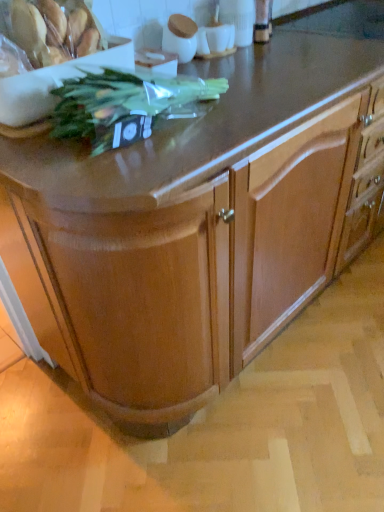
Question: Is green leafy plant at upper left not near translucent plastic bag of cookies at upper left?

Choices:
 (A) yes
 (B) no

Answer: (B)

Question: Considering the relative sizes of green leafy plant at upper left and translucent plastic bag of cookies at upper left in the image provided, is green leafy plant at upper left bigger than translucent plastic bag of cookies at upper left?

Choices:
 (A) no
 (B) yes

Answer: (B)

Question: From the image's perspective, is green leafy plant at upper left beneath translucent plastic bag of cookies at upper left?

Choices:
 (A) no
 (B) yes

Answer: (B)

Question: Is green leafy plant at upper left directly adjacent to translucent plastic bag of cookies at upper left?

Choices:
 (A) yes
 (B) no

Answer: (B)

Question: Considering the relative positions of green leafy plant at upper left and translucent plastic bag of cookies at upper left in the image provided, is green leafy plant at upper left behind translucent plastic bag of cookies at upper left?

Choices:
 (A) no
 (B) yes

Answer: (A)

Question: Is green leafy plant at upper left outside translucent plastic bag of cookies at upper left?

Choices:
 (A) yes
 (B) no

Answer: (A)

Question: Is translucent plastic bag of cookies at upper left with green leafy plant at upper left?

Choices:
 (A) yes
 (B) no

Answer: (B)

Question: From the image's perspective, is translucent plastic bag of cookies at upper left located above green leafy plant at upper left?

Choices:
 (A) yes
 (B) no

Answer: (A)

Question: Is translucent plastic bag of cookies at upper left aimed at green leafy plant at upper left?

Choices:
 (A) no
 (B) yes

Answer: (B)

Question: From a real-world perspective, is translucent plastic bag of cookies at upper left positioned over green leafy plant at upper left based on gravity?

Choices:
 (A) no
 (B) yes

Answer: (B)

Question: From the image's perspective, is translucent plastic bag of cookies at upper left below green leafy plant at upper left?

Choices:
 (A) no
 (B) yes

Answer: (A)

Question: Is translucent plastic bag of cookies at upper left bigger than green leafy plant at upper left?

Choices:
 (A) no
 (B) yes

Answer: (A)

Question: In terms of size, does translucent plastic bag of cookies at upper left appear bigger or smaller than green leafy plant at upper left?

Choices:
 (A) small
 (B) big

Answer: (A)